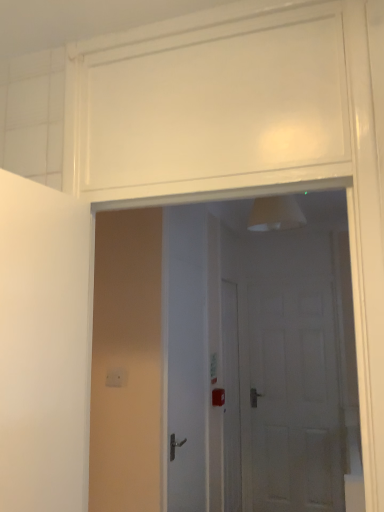
Question: Is white glossy door at center, which ranks as the 2th door in right-to-left order, positioned in front of white glossy door at center, the 3th door when ordered from back to front?

Choices:
 (A) yes
 (B) no

Answer: (B)

Question: Is white glossy door at center, which ranks as the 2th door in right-to-left order, surrounding white glossy door at center, the first door viewed from the front?

Choices:
 (A) no
 (B) yes

Answer: (A)

Question: Can we say white glossy door at center, which ranks as the 2th door in right-to-left order, lies outside white glossy door at center, which appears as the 1th door when viewed from the left?

Choices:
 (A) no
 (B) yes

Answer: (B)

Question: Considering the relative sizes of white glossy door at center, which is the second door in back-to-front order, and white glossy door at center, which appears as the 1th door when viewed from the left, in the image provided, is white glossy door at center, which is the second door in back-to-front order, bigger than white glossy door at center, which appears as the 1th door when viewed from the left,?

Choices:
 (A) yes
 (B) no

Answer: (B)

Question: From a real-world perspective, is white glossy door at center, marked as the 2th door in a front-to-back arrangement, on top of white glossy door at center, the 3th door positioned from the right?

Choices:
 (A) yes
 (B) no

Answer: (B)

Question: Considering the relative sizes of white glossy door at center, marked as the 2th door in a front-to-back arrangement, and white glossy door at center, the 3th door positioned from the right, in the image provided, is white glossy door at center, marked as the 2th door in a front-to-back arrangement, taller than white glossy door at center, the 3th door positioned from the right,?

Choices:
 (A) no
 (B) yes

Answer: (B)

Question: Does white matte door at center, which is counted as the 3th door, starting from the front, come in front of white glossy door at center, which appears as the 1th door when viewed from the left?

Choices:
 (A) yes
 (B) no

Answer: (B)

Question: Is white matte door at center, placed as the third door when sorted from left to right, wider than white glossy door at center, the first door viewed from the front?

Choices:
 (A) no
 (B) yes

Answer: (A)

Question: From a real-world perspective, is white matte door at center, which is counted as the 1th door, starting from the right, beneath white glossy door at center, the 3th door positioned from the right?

Choices:
 (A) no
 (B) yes

Answer: (B)

Question: Considering the relative positions of white matte door at center, which is counted as the 3th door, starting from the front, and white glossy door at center, the first door viewed from the front, in the image provided, is white matte door at center, which is counted as the 3th door, starting from the front, to the left of white glossy door at center, the first door viewed from the front, from the viewer's perspective?

Choices:
 (A) no
 (B) yes

Answer: (A)

Question: Considering the relative sizes of white matte door at center, which is counted as the 1th door, starting from the right, and white glossy door at center, the 3th door positioned from the right, in the image provided, is white matte door at center, which is counted as the 1th door, starting from the right, taller than white glossy door at center, the 3th door positioned from the right,?

Choices:
 (A) yes
 (B) no

Answer: (A)

Question: Is white matte door at center, which ranks as the first door in back-to-front order, facing towards white glossy door at center, which appears as the 1th door when viewed from the left?

Choices:
 (A) yes
 (B) no

Answer: (A)

Question: Is white glossy door at center, the 3th door when ordered from back to front, beside white glossy door at center, which is the 2th door from left to right?

Choices:
 (A) no
 (B) yes

Answer: (A)